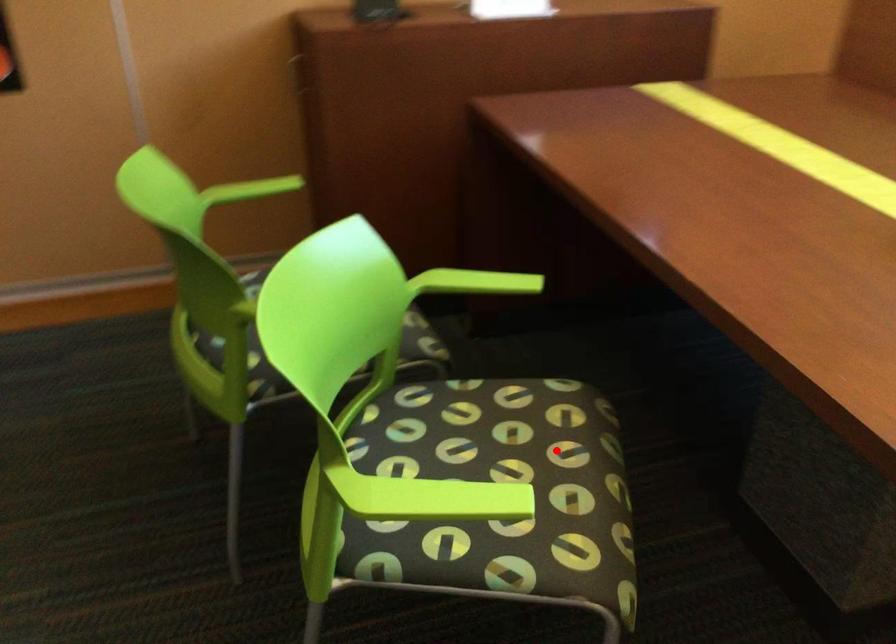
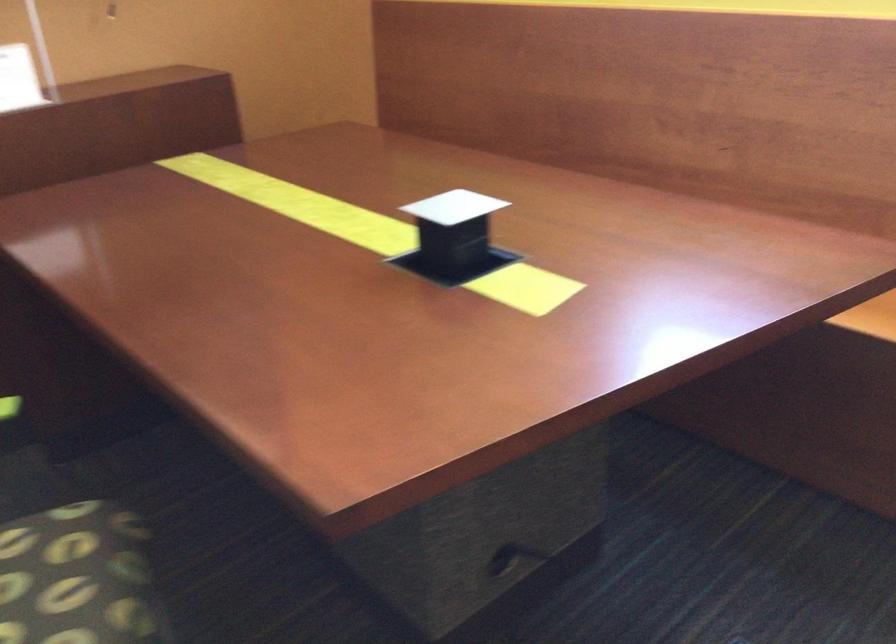
Where in the second image is the point corresponding to the highlighted location from the first image?

(74, 576)